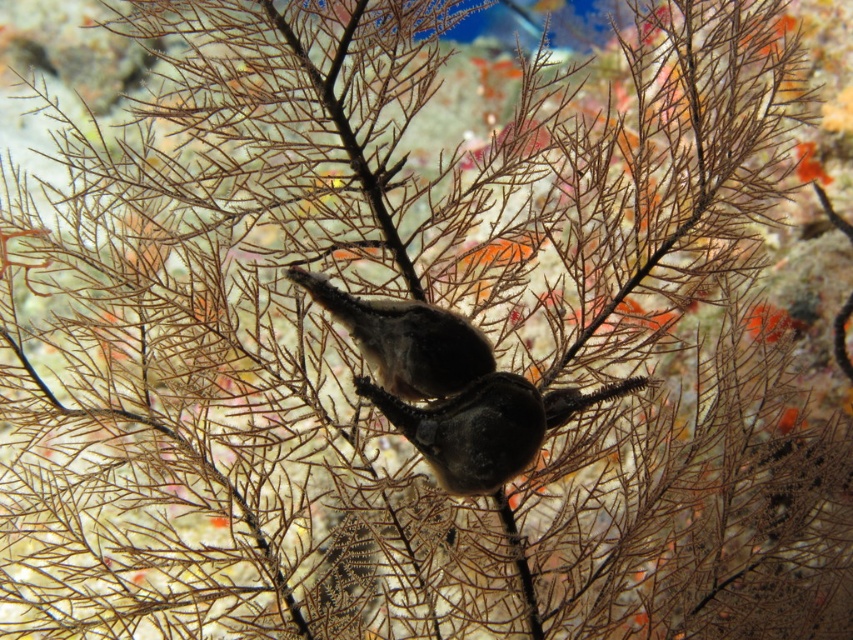
Is smooth dark gray seahorse at center in front of brown textured bird at center?

Yes, smooth dark gray seahorse at center is in front of brown textured bird at center.

From the picture: Does smooth dark gray seahorse at center have a greater width compared to brown textured bird at center?

Yes, smooth dark gray seahorse at center is wider than brown textured bird at center.

This screenshot has height=640, width=853. Find the location of `smooth dark gray seahorse at center`. smooth dark gray seahorse at center is located at coordinates (451, 388).

Image resolution: width=853 pixels, height=640 pixels. In order to click on smooth dark gray seahorse at center in this screenshot , I will do `click(451, 388)`.